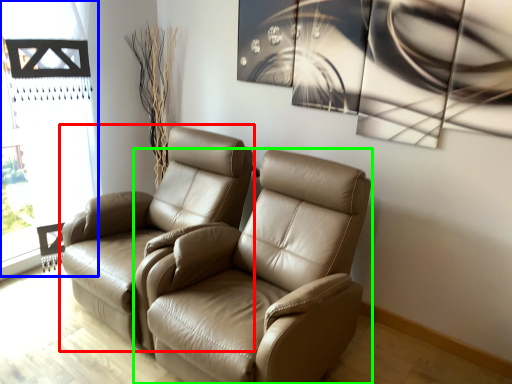
Question: Which is farther away from chair (highlighted by a red box)? window frame (highlighted by a blue box) or chair (highlighted by a green box)?

Choices:
 (A) window frame
 (B) chair

Answer: (A)